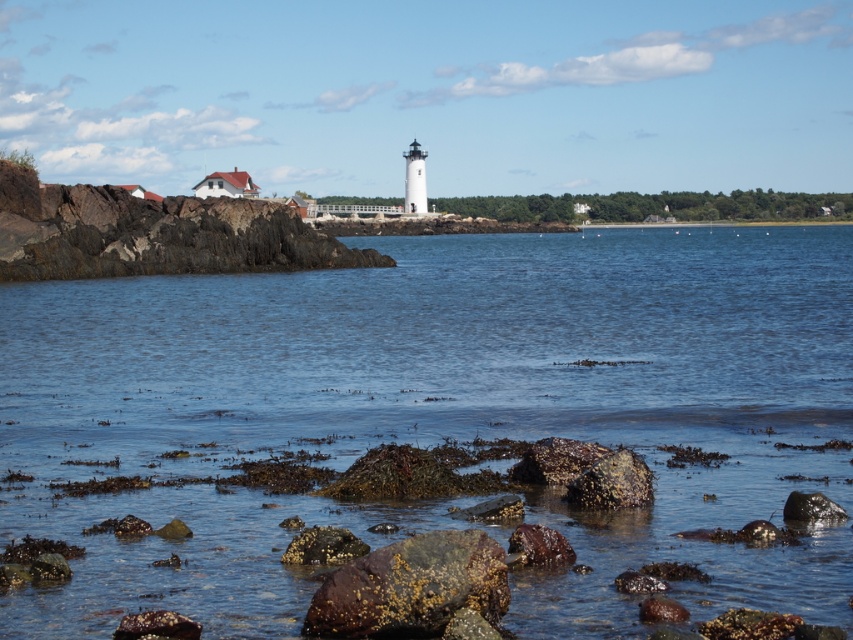
You are standing on the shoreline looking at the scene. Which rock, the rusty metallic rock at center or the smooth gray rock at lower right, is nearer to you?

The rusty metallic rock at center is closer to the viewer than the smooth gray rock at lower right.

You are a photographer planning to capture the lighthouse and its surroundings. You want to ensure that the clear water at center and the rusty stone rocks at left are both visible in your shot. Based on their sizes in the image, which object would appear larger in the photo?

The clear water at center appears larger in the photo because it is much taller than the rusty stone rocks at left.